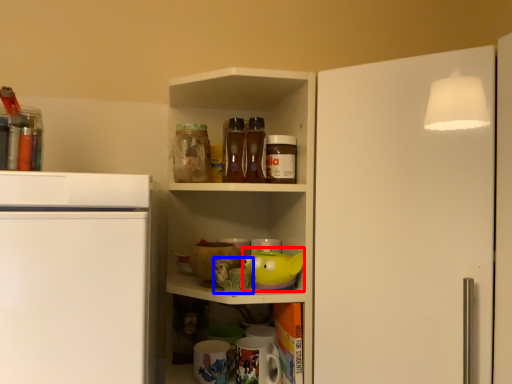
Question: Which object is closer to the camera taking this photo, toy (highlighted by a red box) or toy (highlighted by a blue box)?

Choices:
 (A) toy
 (B) toy

Answer: (B)